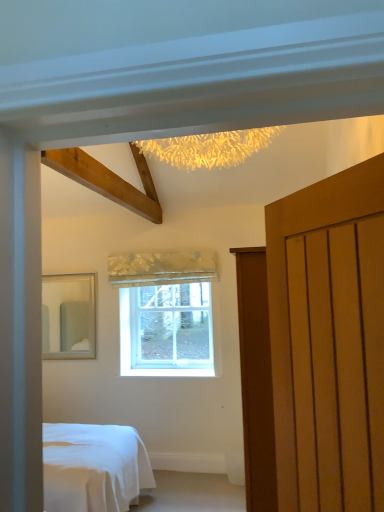
Question: Is matte silver mirror at left taller than clear glass window at center?

Choices:
 (A) yes
 (B) no

Answer: (A)

Question: Does matte silver mirror at left come behind clear glass window at center?

Choices:
 (A) no
 (B) yes

Answer: (A)

Question: Are matte silver mirror at left and clear glass window at center located far from each other?

Choices:
 (A) no
 (B) yes

Answer: (A)

Question: Is matte silver mirror at left not within clear glass window at center?

Choices:
 (A) no
 (B) yes

Answer: (B)

Question: From a real-world perspective, is matte silver mirror at left on clear glass window at center?

Choices:
 (A) no
 (B) yes

Answer: (B)

Question: Is matte silver mirror at left to the right of clear glass window at center from the viewer's perspective?

Choices:
 (A) yes
 (B) no

Answer: (B)

Question: Considering the relative positions of matte wooden door at right and silky gold curtain at center in the image provided, is matte wooden door at right in front of silky gold curtain at center?

Choices:
 (A) no
 (B) yes

Answer: (B)

Question: Is matte wooden door at right further to the viewer compared to silky gold curtain at center?

Choices:
 (A) yes
 (B) no

Answer: (B)

Question: From the image's perspective, is matte wooden door at right under silky gold curtain at center?

Choices:
 (A) yes
 (B) no

Answer: (A)

Question: Would you say silky gold curtain at center is part of matte wooden door at right's contents?

Choices:
 (A) no
 (B) yes

Answer: (A)

Question: From the image's perspective, does matte wooden door at right appear higher than silky gold curtain at center?

Choices:
 (A) no
 (B) yes

Answer: (A)

Question: Is matte wooden door at right taller than silky gold curtain at center?

Choices:
 (A) yes
 (B) no

Answer: (A)

Question: Can you confirm if clear glass window at center is thinner than matte silver mirror at left?

Choices:
 (A) yes
 (B) no

Answer: (A)